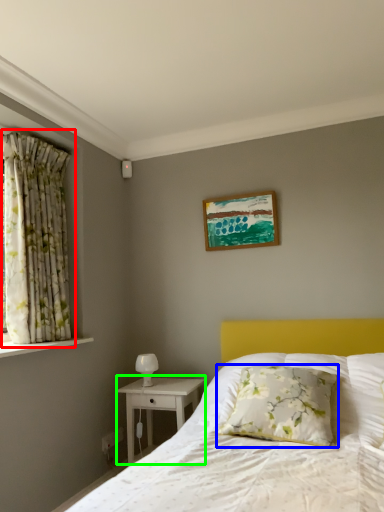
Question: Which object is the farthest from curtain (highlighted by a red box)? Choose among these: pillow (highlighted by a blue box) or nightstand (highlighted by a green box).

Choices:
 (A) pillow
 (B) nightstand

Answer: (A)